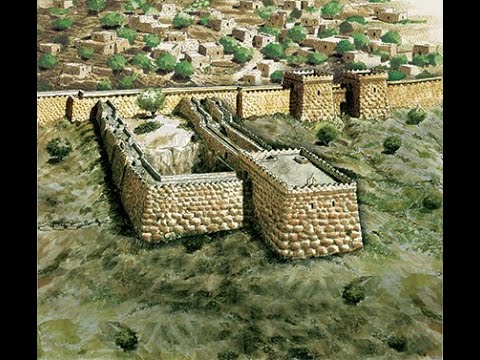
You are a GUI agent. You are given a task and a screenshot of the screen. Output one action in this format:
    pyautogui.click(x=<x>, y=<y>)
    Task: Click on the entrance
    
    Given the screenshot: What is the action you would take?
    pyautogui.click(x=344, y=107)